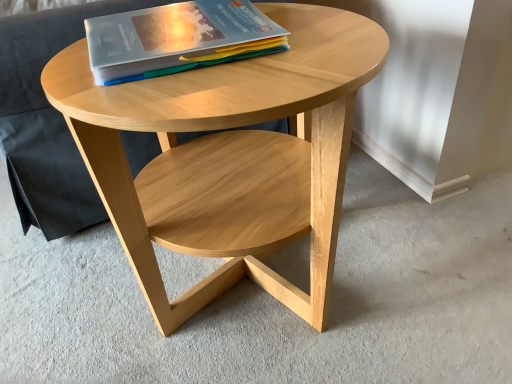
Question: Considering the relative positions of matte plastic book at upper center and natural wood coffee table at center in the image provided, is matte plastic book at upper center to the left or to the right of natural wood coffee table at center?

Choices:
 (A) left
 (B) right

Answer: (A)

Question: Is matte plastic book at upper center wider or thinner than natural wood coffee table at center?

Choices:
 (A) thin
 (B) wide

Answer: (A)

Question: Considering the positions of matte plastic book at upper center and natural wood coffee table at center in the image, is matte plastic book at upper center bigger or smaller than natural wood coffee table at center?

Choices:
 (A) small
 (B) big

Answer: (A)

Question: Is natural wood coffee table at center situated inside matte plastic book at upper center or outside?

Choices:
 (A) inside
 (B) outside

Answer: (B)

Question: Considering the positions of natural wood coffee table at center and matte plastic book at upper center in the image, is natural wood coffee table at center wider or thinner than matte plastic book at upper center?

Choices:
 (A) wide
 (B) thin

Answer: (A)

Question: From the image's perspective, is natural wood coffee table at center located above or below matte plastic book at upper center?

Choices:
 (A) below
 (B) above

Answer: (A)

Question: Based on their sizes in the image, would you say natural wood coffee table at center is bigger or smaller than matte plastic book at upper center?

Choices:
 (A) small
 (B) big

Answer: (B)